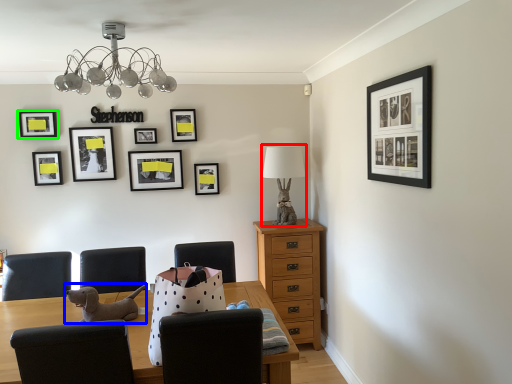
Question: Based on their relative distances, which object is farther from table lamp (highlighted by a red box)? Choose from animal (highlighted by a blue box) and picture frame (highlighted by a green box).

Choices:
 (A) animal
 (B) picture frame

Answer: (B)